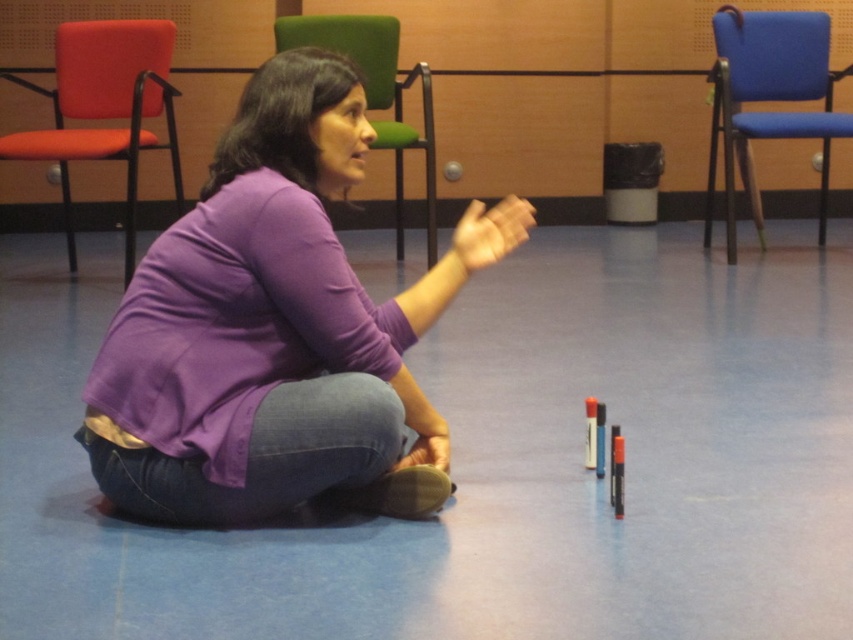
You are a guest entering the room and want to sit down. There is an orange fabric chair at left and a green fabric chair at upper center. Which chair is closer to the woman who is sitting on the floor with the markers?

The orange fabric chair at left is closer to the woman who is sitting on the floor with the markers because it is positioned to the left of the green fabric chair at upper center, and the woman is in the lower part of the room.

From the picture: You are a tailor measuring fabrics for a project. You have a piece of fabric that is exactly the same width as the blue fabric chair at right. Can the purple soft shirt at center be made from this fabric without needing to sew multiple pieces together?

The purple soft shirt at center is wider than the blue fabric chair at right. Since the fabric width matches the chair, it would not be sufficient to make the shirt without sewing multiple pieces together.